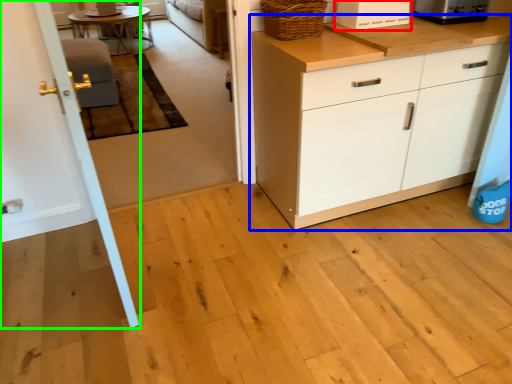
Question: Which object is the closest to the appliance (highlighted by a red box)? Choose among these: cabinetry (highlighted by a blue box) or door (highlighted by a green box).

Choices:
 (A) cabinetry
 (B) door

Answer: (A)